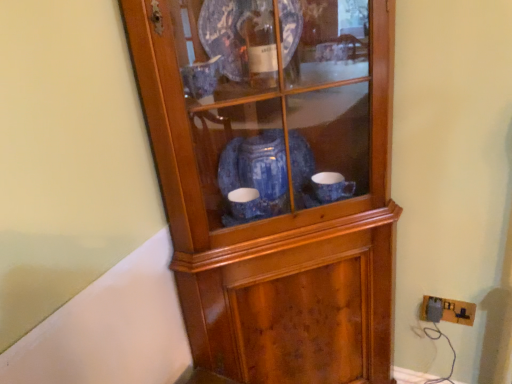
The height and width of the screenshot is (384, 512). In order to click on wooden cupboard at center in this screenshot , I will do point(274,181).

What do you see at coordinates (274, 181) in the screenshot? I see `wooden cupboard at center` at bounding box center [274, 181].

Image resolution: width=512 pixels, height=384 pixels. Find the location of `brown cardboard electric outlet at lower right`. brown cardboard electric outlet at lower right is located at coordinates (452, 310).

What do you see at coordinates (452, 310) in the screenshot? I see `brown cardboard electric outlet at lower right` at bounding box center [452, 310].

In order to face brown cardboard electric outlet at lower right, should I rotate leftwards or rightwards?

Rotate right and turn 23.561 degrees.

Where is `wooden cupboard at center`? Image resolution: width=512 pixels, height=384 pixels. wooden cupboard at center is located at coordinates (274, 181).

Which object is positioned more to the left, brown cardboard electric outlet at lower right or wooden cupboard at center?

From the viewer's perspective, wooden cupboard at center appears more on the left side.

Is the depth of brown cardboard electric outlet at lower right greater than that of wooden cupboard at center?

Yes, it is behind wooden cupboard at center.

Which is closer, [459,318] or [385,348]?

The point [459,318] is in front.

From the image's perspective, is brown cardboard electric outlet at lower right below wooden cupboard at center?

Correct, brown cardboard electric outlet at lower right appears lower than wooden cupboard at center in the image.

Consider the image. From a real-world perspective, is brown cardboard electric outlet at lower right positioned under wooden cupboard at center based on gravity?

Yes, from a real-world perspective, brown cardboard electric outlet at lower right is beneath wooden cupboard at center.

Considering the relative sizes of brown cardboard electric outlet at lower right and wooden cupboard at center in the image provided, is brown cardboard electric outlet at lower right thinner than wooden cupboard at center?

Yes.

Who is taller, brown cardboard electric outlet at lower right or wooden cupboard at center?

Standing taller between the two is wooden cupboard at center.

Considering the sizes of objects brown cardboard electric outlet at lower right and wooden cupboard at center in the image provided, who is smaller, brown cardboard electric outlet at lower right or wooden cupboard at center?

With smaller size is brown cardboard electric outlet at lower right.

Would you say brown cardboard electric outlet at lower right contains wooden cupboard at center?

No, brown cardboard electric outlet at lower right does not contain wooden cupboard at center.

Are brown cardboard electric outlet at lower right and wooden cupboard at center beside each other?

No.

Is brown cardboard electric outlet at lower right looking in the opposite direction of wooden cupboard at center?

brown cardboard electric outlet at lower right does not have its back to wooden cupboard at center.

Where is `electric outlet that is behind the wooden cupboard at center`? electric outlet that is behind the wooden cupboard at center is located at coordinates (452, 310).

Which object is positioned more to the right, wooden cupboard at center or brown cardboard electric outlet at lower right?

From the viewer's perspective, brown cardboard electric outlet at lower right appears more on the right side.

Who is more distant, wooden cupboard at center or brown cardboard electric outlet at lower right?

brown cardboard electric outlet at lower right is further away from the camera.

Considering the positions of point (374, 125) and point (452, 318), is point (374, 125) closer or farther from the camera than point (452, 318)?

Point (374, 125) appears to be closer to the viewer than point (452, 318).

From the image's perspective, which one is positioned lower, wooden cupboard at center or brown cardboard electric outlet at lower right?

brown cardboard electric outlet at lower right is shown below in the image.

From a real-world perspective, between wooden cupboard at center and brown cardboard electric outlet at lower right, who is vertically lower?

brown cardboard electric outlet at lower right, from a real-world perspective.

Considering the relative sizes of wooden cupboard at center and brown cardboard electric outlet at lower right in the image provided, is wooden cupboard at center wider than brown cardboard electric outlet at lower right?

Correct, the width of wooden cupboard at center exceeds that of brown cardboard electric outlet at lower right.

Considering the sizes of wooden cupboard at center and brown cardboard electric outlet at lower right in the image, is wooden cupboard at center taller or shorter than brown cardboard electric outlet at lower right?

Clearly, wooden cupboard at center is taller compared to brown cardboard electric outlet at lower right.

Looking at this image, considering the sizes of objects wooden cupboard at center and brown cardboard electric outlet at lower right in the image provided, who is bigger, wooden cupboard at center or brown cardboard electric outlet at lower right?

wooden cupboard at center.

Can brown cardboard electric outlet at lower right be found inside wooden cupboard at center?

No, brown cardboard electric outlet at lower right is not inside wooden cupboard at center.

Is wooden cupboard at center directly adjacent to brown cardboard electric outlet at lower right?

No, wooden cupboard at center is not beside brown cardboard electric outlet at lower right.

Is wooden cupboard at center turned away from brown cardboard electric outlet at lower right?

No, wooden cupboard at center is not facing the opposite direction of brown cardboard electric outlet at lower right.

How many degrees apart are the facing directions of wooden cupboard at center and brown cardboard electric outlet at lower right?

There is a 45-degree angle between the facing directions of wooden cupboard at center and brown cardboard electric outlet at lower right.

This screenshot has height=384, width=512. In order to click on electric outlet beneath the wooden cupboard at center (from a real-world perspective) in this screenshot , I will do point(452,310).

At what (x,y) coordinates should I click in order to perform the action: click on cupboard above the brown cardboard electric outlet at lower right (from a real-world perspective). Please return your answer as a coordinate pair (x, y). This screenshot has height=384, width=512. Looking at the image, I should click on coord(274,181).

This screenshot has height=384, width=512. Identify the location of electric outlet on the right of wooden cupboard at center. (452, 310).